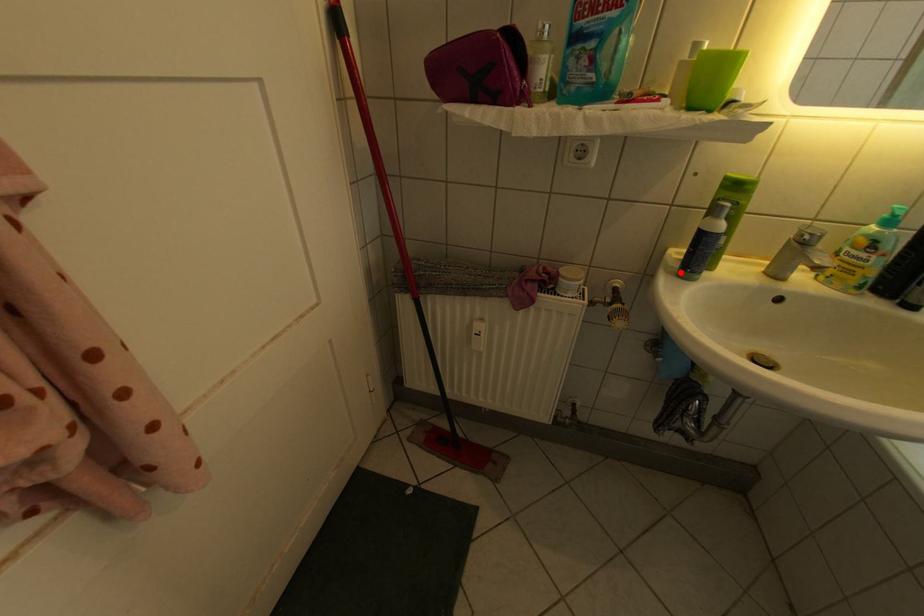
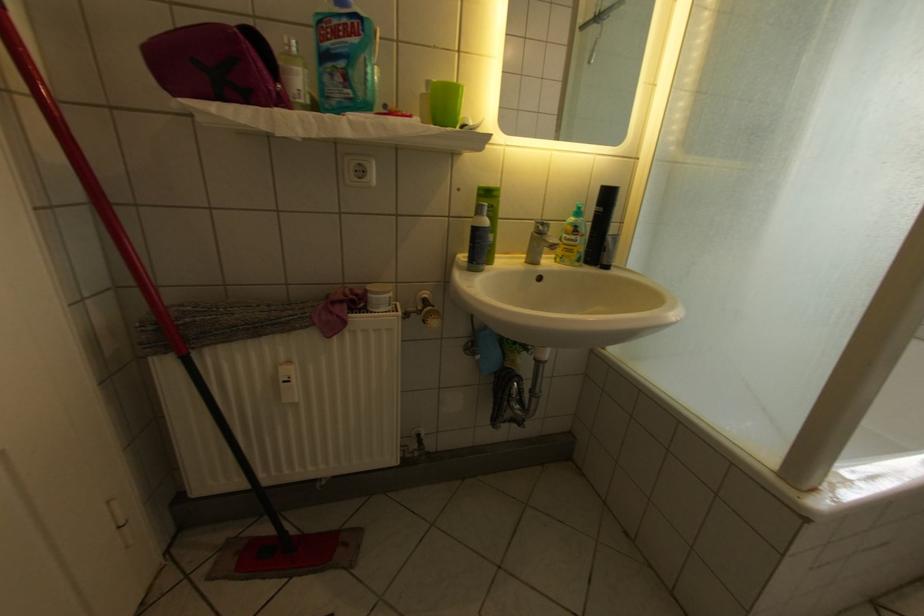
Where in the second image is the point corresponding to the highlighted location from the first image?

(472, 270)